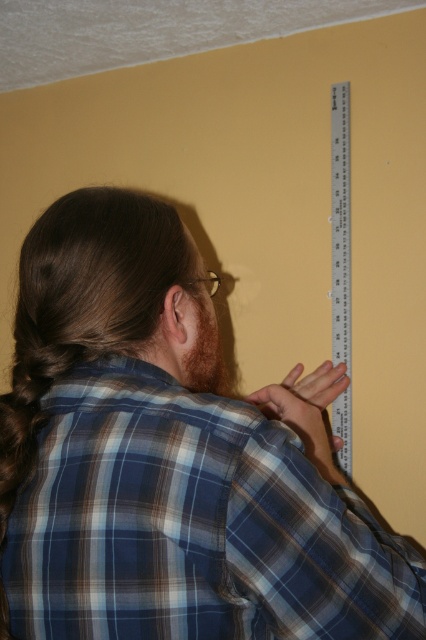
You are an interior designer trying to hang a picture frame that requires precise placement. You notice the blue plaid shirt at upper center and the brown fuzzy beard at back in the scene. How far apart are these two features?

The blue plaid shirt at upper center and the brown fuzzy beard at back are 6.07 inches apart.

You are an interior designer assessing the space in the image. You notice the blue plaid shirt at upper center and the clear plastic ruler at upper right. Which object appears shorter in the image?

The blue plaid shirt at upper center appears shorter than the clear plastic ruler at upper right.